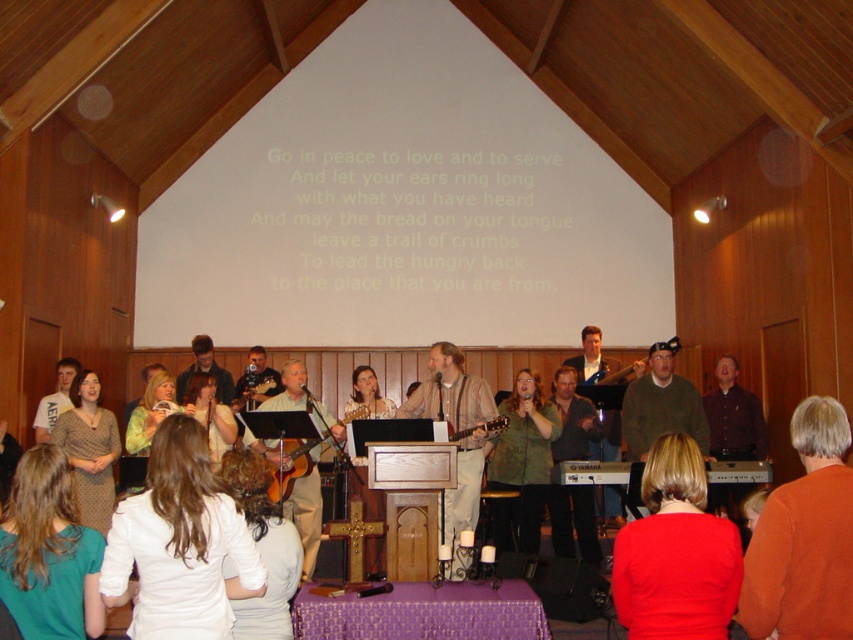
Question: Which of the following is the closest to the observer?

Choices:
 (A) (564, 531)
 (B) (804, 596)
 (C) (190, 442)

Answer: (B)

Question: From the image, what is the correct spatial relationship of green textured sweater at center in relation to smooth beige sweater at center?

Choices:
 (A) below
 (B) above

Answer: (A)

Question: Which object is positioned farthest from the green textured sweater at center?

Choices:
 (A) red matte sweater at lower right
 (B) green fabric shirt at lower left
 (C) smooth beige sweater at center

Answer: (B)

Question: Observing the image, what is the correct spatial positioning of red matte sweater at lower right in reference to green textured sweater at center?

Choices:
 (A) above
 (B) below

Answer: (A)

Question: Does white fabric shirt at lower center come behind patterned fabric dress at lower left?

Choices:
 (A) yes
 (B) no

Answer: (B)

Question: Which point appears farthest from the camera in this image?

Choices:
 (A) (85, 506)
 (B) (842, 492)
 (C) (653, 513)
 (D) (582, 444)

Answer: (D)